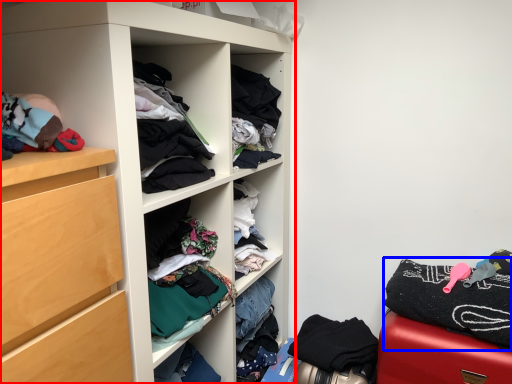
Question: Which object is further to the camera taking this photo, cupboard (highlighted by a red box) or clothing (highlighted by a blue box)?

Choices:
 (A) cupboard
 (B) clothing

Answer: (B)